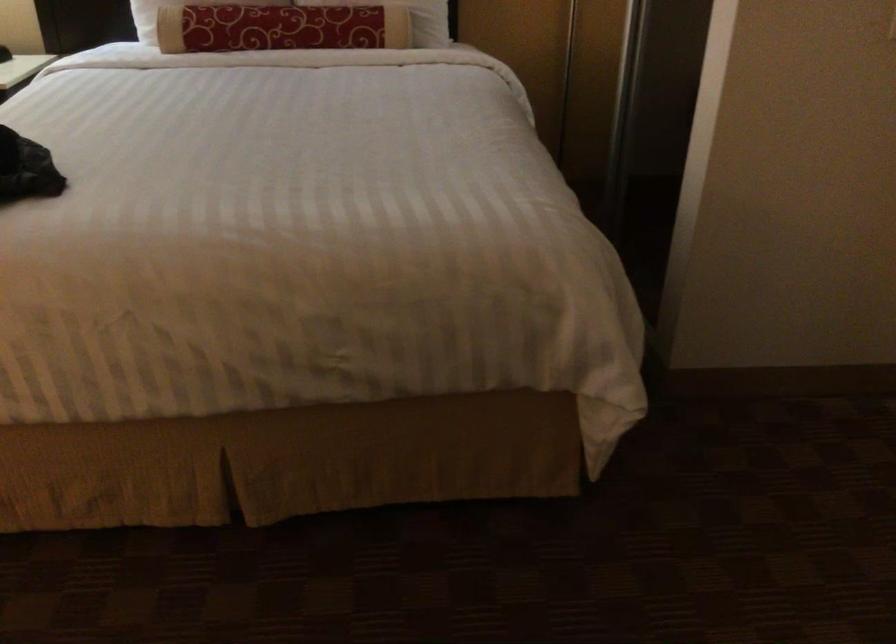
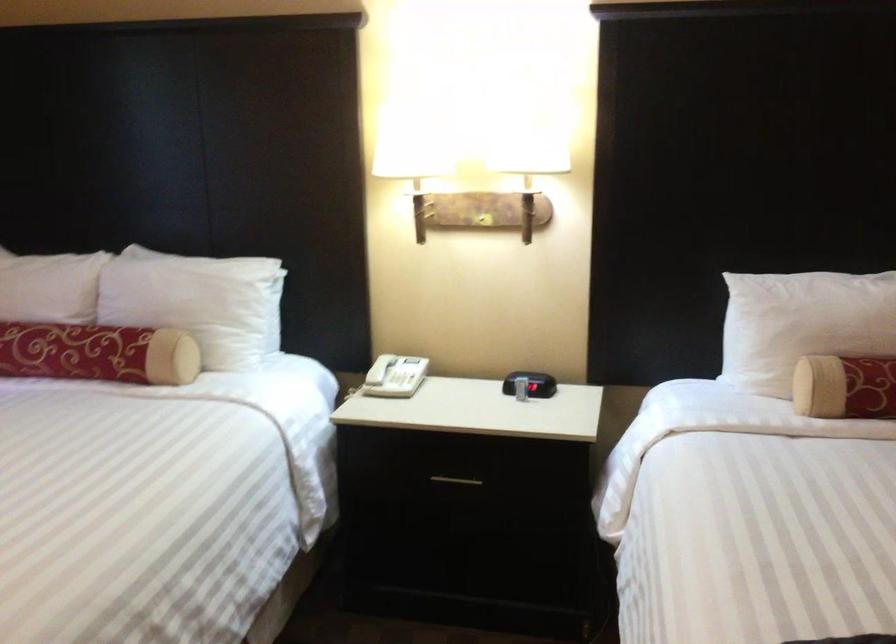
In a continuous first-person perspective shot, in which direction is the camera moving?

The cameraman walked toward left, forward.